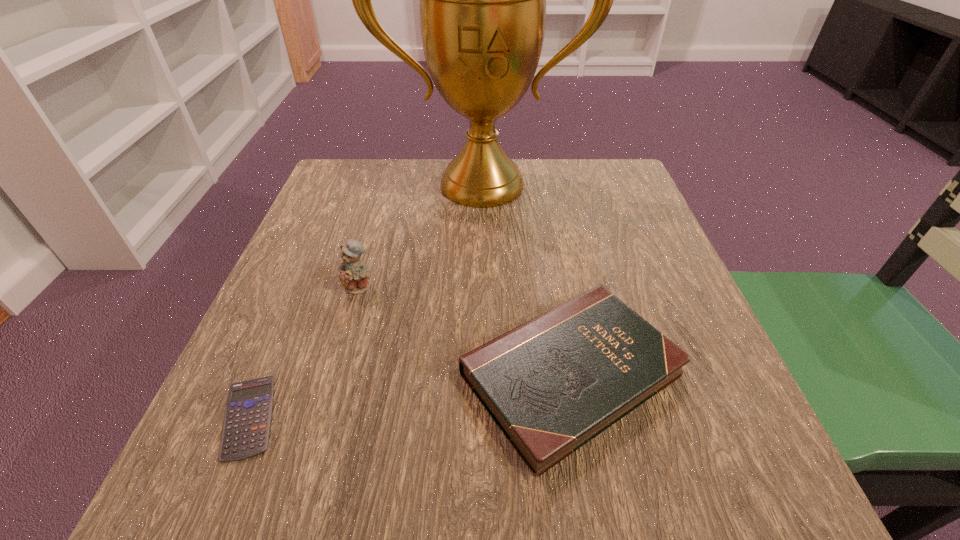
You are a GUI agent. You are given a task and a screenshot of the screen. Output one action in this format:
    pyautogui.click(x=<x>, y=<y>)
    Task: Click on the farthest object
    The image size is (960, 540).
    Given the screenshot: What is the action you would take?
    pyautogui.click(x=482, y=0)

Where is `the tallest object`? The width and height of the screenshot is (960, 540). the tallest object is located at coordinates (482, 0).

I want to click on the second farthest object, so click(354, 274).

Locate an element on the screen. This screenshot has height=540, width=960. the second tallest object is located at coordinates (354, 274).

The image size is (960, 540). I want to click on Bible, so click(552, 384).

This screenshot has height=540, width=960. What are the coordinates of `the shortest object` in the screenshot? It's located at (246, 427).

This screenshot has width=960, height=540. I want to click on calculator, so click(x=246, y=427).

The width and height of the screenshot is (960, 540). In order to click on vacant area situated 0.310m on the surface of the tallest object with symbols in this screenshot , I will do `click(483, 315)`.

Identify the location of free region located 0.270m on the front-facing side of the second farthest object. (317, 436).

The height and width of the screenshot is (540, 960). Identify the location of vacant area located 0.100m on the left of the Bible. point(395,374).